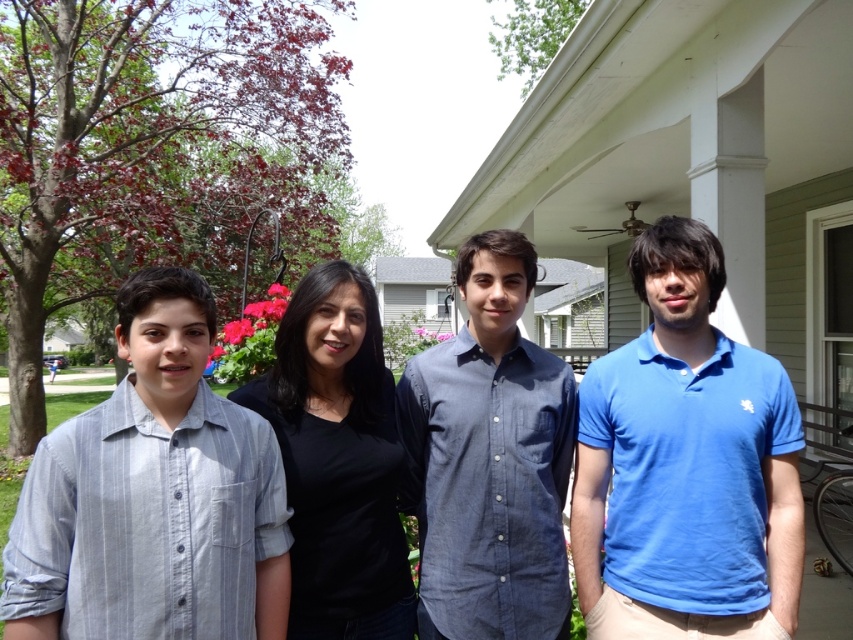
Does blue cotton polo shirt at center lie behind blue denim shirt at center?

No, blue cotton polo shirt at center is closer to the viewer.

Which of these two, blue cotton polo shirt at center or blue denim shirt at center, stands taller?

blue cotton polo shirt at center

Who is more distant from viewer, (x=753, y=413) or (x=532, y=611)?

The point (x=532, y=611) is more distant.

At what (x,y) coordinates should I click in order to perform the action: click on blue cotton polo shirt at center. Please return your answer as a coordinate pair (x, y). This screenshot has width=853, height=640. Looking at the image, I should click on (686, 465).

Measure the distance from light blue striped shirt at left to light blue striped shirt at center.

light blue striped shirt at left and light blue striped shirt at center are 1.23 meters apart.

What do you see at coordinates (154, 497) in the screenshot?
I see `light blue striped shirt at left` at bounding box center [154, 497].

Between point (221, 602) and point (718, 252), which one is positioned in front?

Point (221, 602) is in front.

Where is `light blue striped shirt at left`? This screenshot has width=853, height=640. light blue striped shirt at left is located at coordinates (154, 497).

Measure the distance between blue cotton polo shirt at center and light blue striped shirt at center.

blue cotton polo shirt at center and light blue striped shirt at center are 0.51 inches apart.

Identify the location of blue cotton polo shirt at center. The width and height of the screenshot is (853, 640). (686, 465).

Identify the location of blue cotton polo shirt at center. Image resolution: width=853 pixels, height=640 pixels. (686, 465).